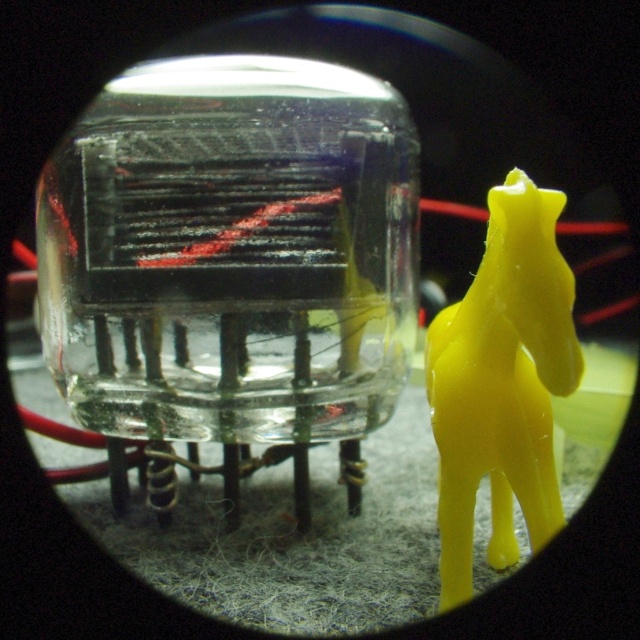
Can you confirm if transparent glass tube at center is shorter than yellow matte plastic horse at right?

No, transparent glass tube at center is not shorter than yellow matte plastic horse at right.

Can you confirm if transparent glass tube at center is positioned to the left of yellow matte plastic horse at right?

Indeed, transparent glass tube at center is positioned on the left side of yellow matte plastic horse at right.

Is point (160, 424) less distant than point (515, 301)?

No, it is not.

At what (x,y) coordinates should I click in order to perform the action: click on transparent glass tube at center. Please return your answer as a coordinate pair (x, y). The height and width of the screenshot is (640, 640). Looking at the image, I should click on (x=230, y=264).